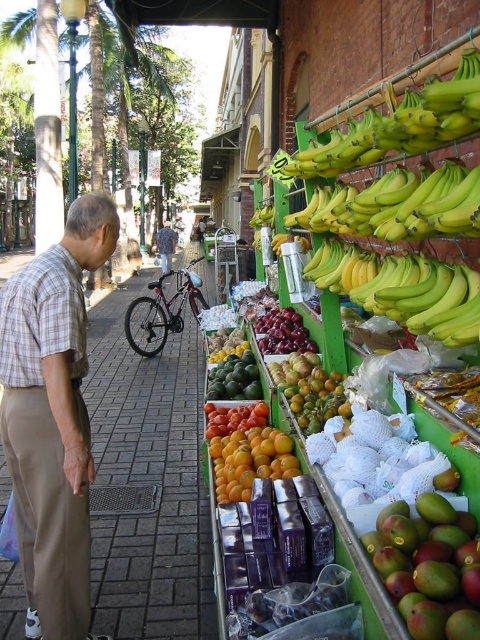
Question: Which point is closer to the camera?

Choices:
 (A) (6, 385)
 (B) (277, 332)
 (C) (226, 385)

Answer: (A)

Question: In this image, where is green matte mango at lower right located relative to camouflage jacket at center?

Choices:
 (A) right
 (B) left

Answer: (A)

Question: Is plaid cotton shirt at left further to camera compared to camouflage jacket at center?

Choices:
 (A) yes
 (B) no

Answer: (B)

Question: Among these points, which one is nearest to the camera?

Choices:
 (A) (61, 444)
 (B) (392, 596)
 (C) (265, 320)

Answer: (B)

Question: Estimate the real-world distances between objects in this image. Which object is farther from the orangesmoothfruit at center?

Choices:
 (A) shiny red tomatoes at center
 (B) green matte avocados at center
 (C) green matte mango at lower right

Answer: (C)

Question: From the image, what is the correct spatial relationship of green matte mango at lower right in relation to shiny red tomatoes at center?

Choices:
 (A) below
 (B) above

Answer: (B)